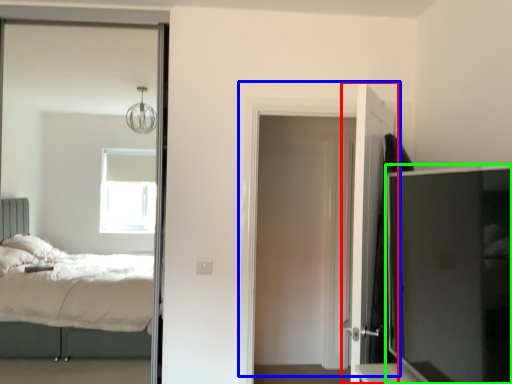
Question: Estimate the real-world distances between objects in this image. Which object is closer to door (highlighted by a red box), door (highlighted by a blue box) or tv cabinet (highlighted by a green box)?

Choices:
 (A) door
 (B) tv cabinet

Answer: (B)